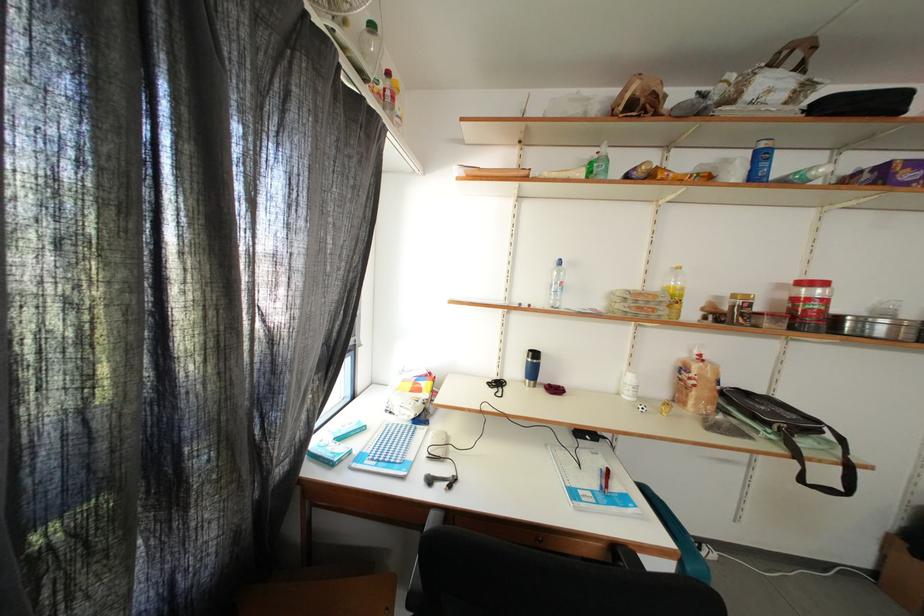
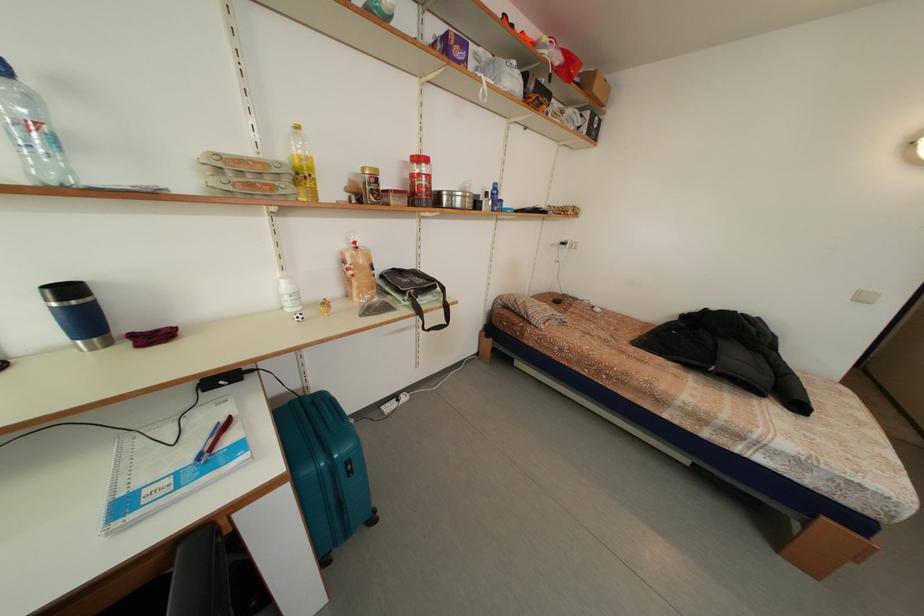
In the second image, find the point that corresponds to [708,361] in the first image.

(362, 248)